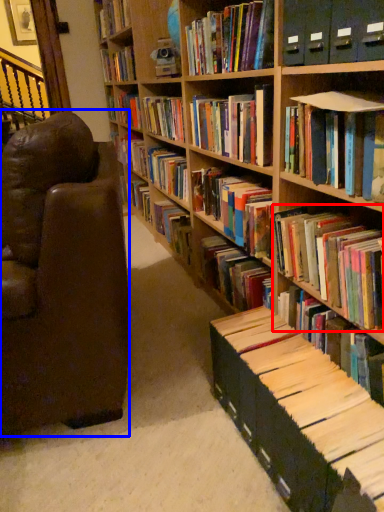
Question: Among these objects, which one is farthest to the camera, book (highlighted by a red box) or chair (highlighted by a blue box)?

Choices:
 (A) book
 (B) chair

Answer: (B)